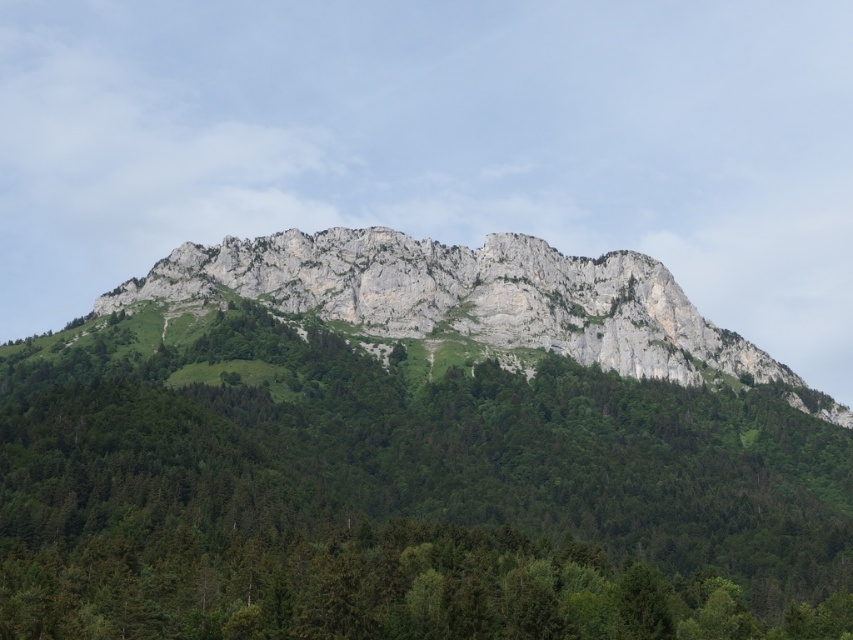
Does green leafy trees at center appear under rugged stone mountain at center?

Correct, green leafy trees at center is located below rugged stone mountain at center.

Image resolution: width=853 pixels, height=640 pixels. What do you see at coordinates (402, 497) in the screenshot?
I see `green leafy trees at center` at bounding box center [402, 497].

Does point (80, 582) come behind point (387, 298)?

No, (80, 582) is closer to viewer.

At what (x,y) coordinates should I click in order to perform the action: click on green leafy trees at center. Please return your answer as a coordinate pair (x, y). Looking at the image, I should click on (402, 497).